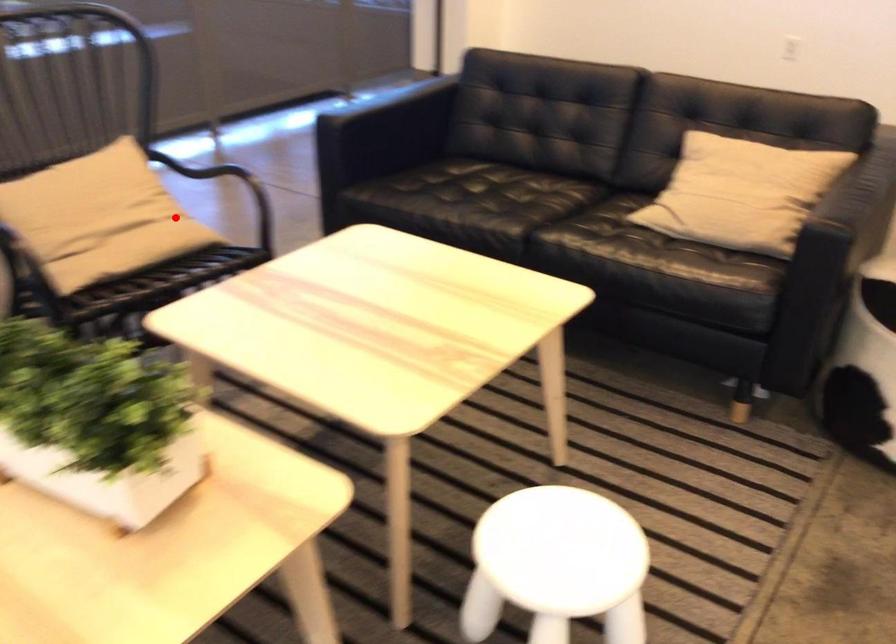
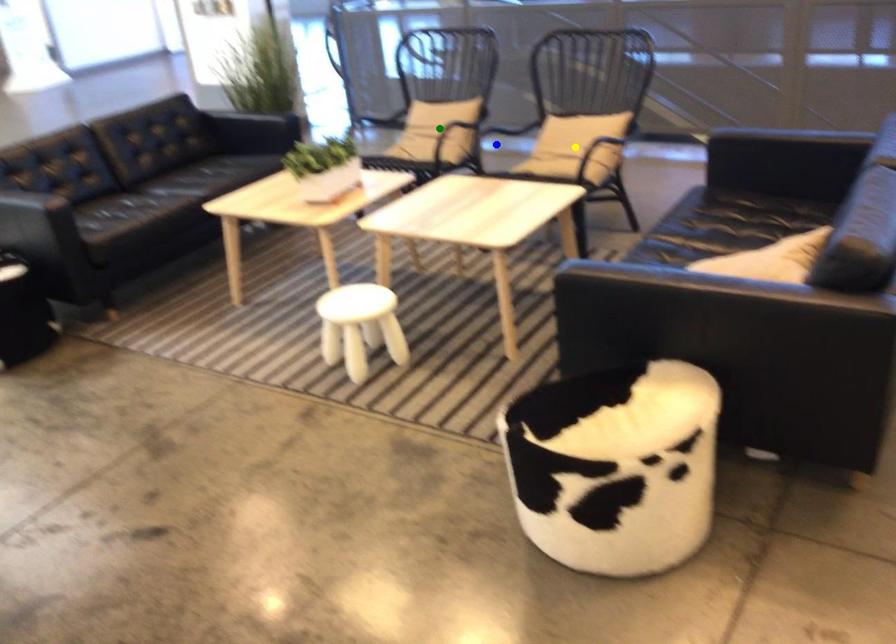
Question: I am providing you with two images of the same scene from different viewpoints. A red point is marked on the first image. You are given multiple points on the second image. In image 2, which mark is for the same physical point as the one in image 1?

Choices:
 (A) blue point
 (B) yellow point
 (C) green point

Answer: (B)